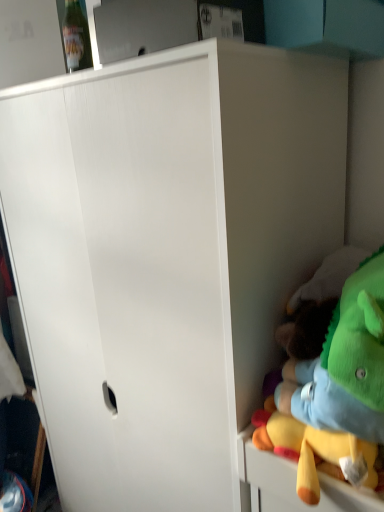
Describe the element at coordinates (76, 38) in the screenshot. This screenshot has height=512, width=384. I see `transparent plastic bottle at upper left` at that location.

You are a GUI agent. You are given a task and a screenshot of the screen. Output one action in this format:
    pyautogui.click(x=<x>, y=<y>)
    Task: Click on the transparent plastic bottle at upper left
    This screenshot has width=384, height=512.
    Given the screenshot: What is the action you would take?
    pyautogui.click(x=76, y=38)

Locate an element on the screen. soft plush toy at right is located at coordinates (335, 383).

Image resolution: width=384 pixels, height=512 pixels. What do you see at coordinates (335, 383) in the screenshot?
I see `soft plush toy at right` at bounding box center [335, 383].

At what (x,y) coordinates should I click in order to perform the action: click on transparent plastic bottle at upper left. Please return your answer as a coordinate pair (x, y). The image size is (384, 512). Looking at the image, I should click on (76, 38).

Is transparent plastic bottle at upper left to the right of soft plush toy at right from the viewer's perspective?

In fact, transparent plastic bottle at upper left is to the left of soft plush toy at right.

Considering the positions of objects transparent plastic bottle at upper left and soft plush toy at right in the image provided, who is behind, transparent plastic bottle at upper left or soft plush toy at right?

transparent plastic bottle at upper left.

Which point is more distant from viewer, (85, 61) or (277, 425)?

Point (85, 61)

From the image's perspective, is transparent plastic bottle at upper left beneath soft plush toy at right?

No.

From a real-world perspective, which object stands above the other?

transparent plastic bottle at upper left.

Can you confirm if transparent plastic bottle at upper left is thinner than soft plush toy at right?

Yes.

Is transparent plastic bottle at upper left taller than soft plush toy at right?

No, transparent plastic bottle at upper left is not taller than soft plush toy at right.

Based on the photo, between transparent plastic bottle at upper left and soft plush toy at right, which one has larger size?

soft plush toy at right.

Is transparent plastic bottle at upper left not inside soft plush toy at right?

Yes, transparent plastic bottle at upper left is located beyond the bounds of soft plush toy at right.

Is transparent plastic bottle at upper left far away from soft plush toy at right?

No.

Could you tell me if transparent plastic bottle at upper left is turned towards soft plush toy at right?

No, transparent plastic bottle at upper left is not facing towards soft plush toy at right.

How much distance is there between transparent plastic bottle at upper left and soft plush toy at right?

They are 32.97 inches apart.

This screenshot has height=512, width=384. I want to click on toy below the transparent plastic bottle at upper left (from the image's perspective), so click(x=335, y=383).

Which object is positioned more to the right, soft plush toy at right or transparent plastic bottle at upper left?

From the viewer's perspective, soft plush toy at right appears more on the right side.

Between soft plush toy at right and transparent plastic bottle at upper left, which one is positioned in front?

soft plush toy at right is in front.

Considering the points (364, 442) and (66, 61), which point is behind, point (364, 442) or point (66, 61)?

The point (66, 61) is farther from the camera.

From the image's perspective, is soft plush toy at right under transparent plastic bottle at upper left?

Indeed, from the image's perspective, soft plush toy at right is shown beneath transparent plastic bottle at upper left.

From a real-world perspective, is soft plush toy at right above or below transparent plastic bottle at upper left?

soft plush toy at right is below transparent plastic bottle at upper left.

Which of these two, soft plush toy at right or transparent plastic bottle at upper left, is thinner?

transparent plastic bottle at upper left is thinner.

Is soft plush toy at right taller than transparent plastic bottle at upper left?

Yes, soft plush toy at right is taller than transparent plastic bottle at upper left.

Considering the relative sizes of soft plush toy at right and transparent plastic bottle at upper left in the image provided, is soft plush toy at right smaller than transparent plastic bottle at upper left?

Incorrect, soft plush toy at right is not smaller in size than transparent plastic bottle at upper left.

Is soft plush toy at right positioned beyond the bounds of transparent plastic bottle at upper left?

Yes, soft plush toy at right is not within transparent plastic bottle at upper left.

Is soft plush toy at right directly adjacent to transparent plastic bottle at upper left?

There is a gap between soft plush toy at right and transparent plastic bottle at upper left.

Could you tell me if soft plush toy at right is turned towards transparent plastic bottle at upper left?

No, soft plush toy at right is not aimed at transparent plastic bottle at upper left.

In the image, there is a transparent plastic bottle at upper left. In order to click on toy below it (from the image's perspective) in this screenshot , I will do `click(335, 383)`.

The height and width of the screenshot is (512, 384). In the image, there is a transparent plastic bottle at upper left. What are the coordinates of `toy below it (from a real-world perspective)` in the screenshot? It's located at click(x=335, y=383).

Where is `bottle behind the soft plush toy at right`? This screenshot has width=384, height=512. bottle behind the soft plush toy at right is located at coordinates (76, 38).